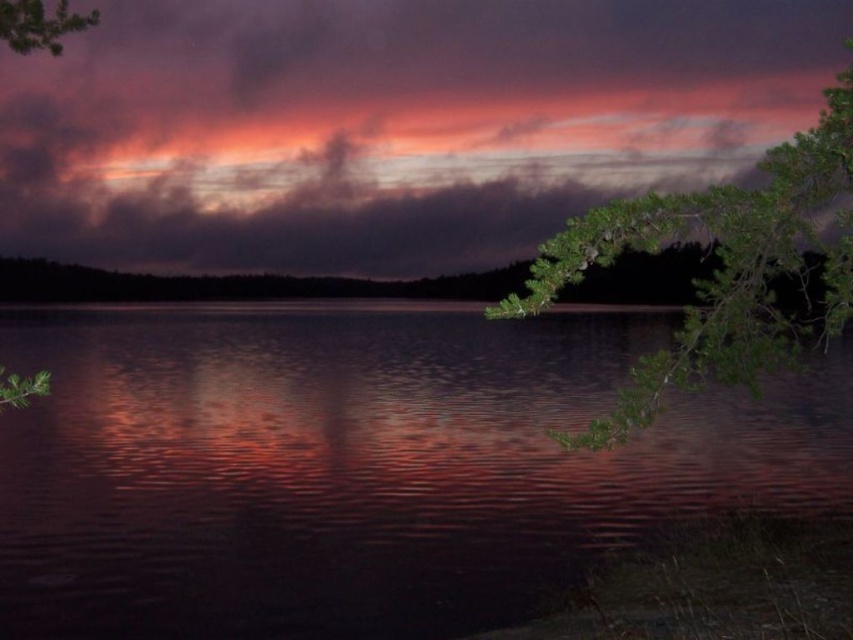
You are an observer looking at the serene lakeside scene. You notice two green leafy branches in the image. Which branch is closer to you, the green leafy branch at right or the green leafy branch at upper left?

The green leafy branch at right is closer to you because it is in front of the green leafy branch at upper left.

You are an artist trying to paint the scene. You notice the glossy water at center and the cloudy sky at upper center. Which one should you paint first if you want to start with the larger area?

The glossy water at center is bigger than the cloudy sky at upper center, so you should paint the glossy water at center first.